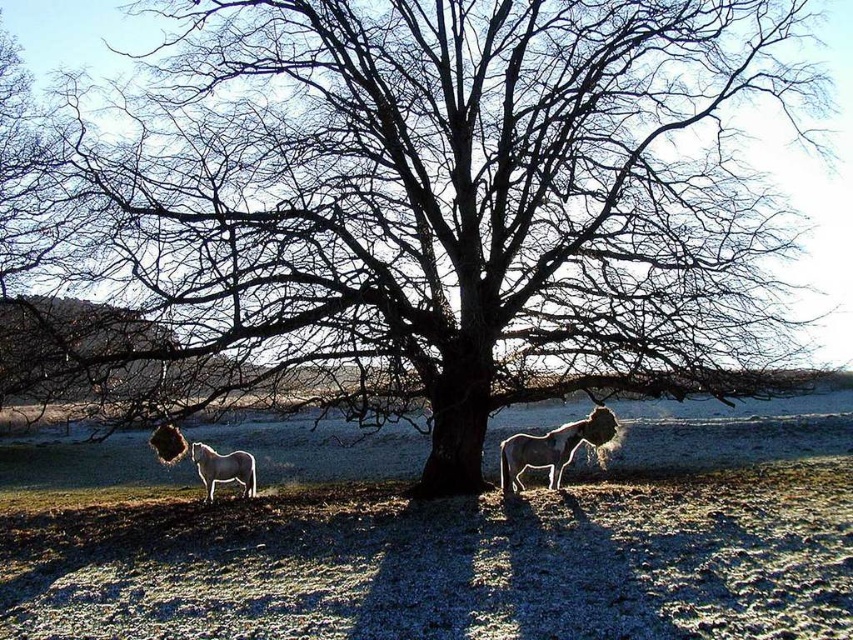
Question: Does white glossy horse at center have a greater width compared to white glossy horse at lower left?

Choices:
 (A) no
 (B) yes

Answer: (B)

Question: Can you confirm if white glossy horse at center is wider than white glossy horse at lower left?

Choices:
 (A) no
 (B) yes

Answer: (B)

Question: Which of the following is the farthest from the observer?

Choices:
 (A) (560, 464)
 (B) (213, 484)

Answer: (B)

Question: Which point is farther from the camera taking this photo?

Choices:
 (A) (227, 474)
 (B) (518, 435)

Answer: (B)

Question: Which point appears farthest from the camera in this image?

Choices:
 (A) (550, 464)
 (B) (206, 445)

Answer: (B)

Question: Does white glossy horse at center have a larger size compared to white glossy horse at lower left?

Choices:
 (A) no
 (B) yes

Answer: (B)